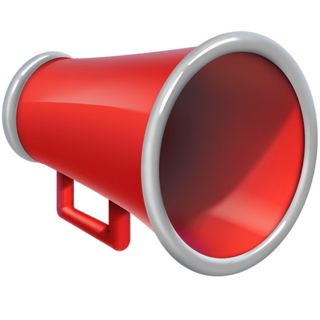
You are a GUI agent. You are given a task and a screenshot of the screen. Output one action in this format:
    pyautogui.click(x=<x>, y=<y>)
    Task: Click on the handle
    Image resolution: width=320 pixels, height=320 pixels.
    Given the screenshot: What is the action you would take?
    pyautogui.click(x=112, y=234)